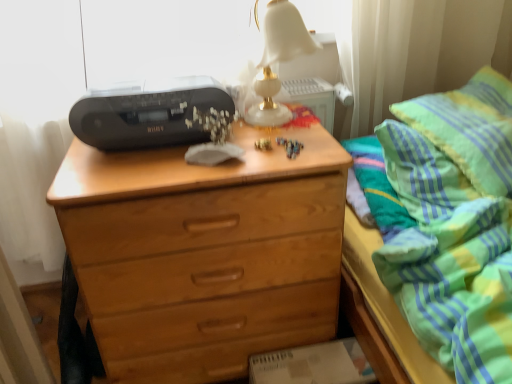
The height and width of the screenshot is (384, 512). What are the coordinates of `vacant area situated below white marble table lamp at upper center (from a real-world perspective)` in the screenshot? It's located at (272, 126).